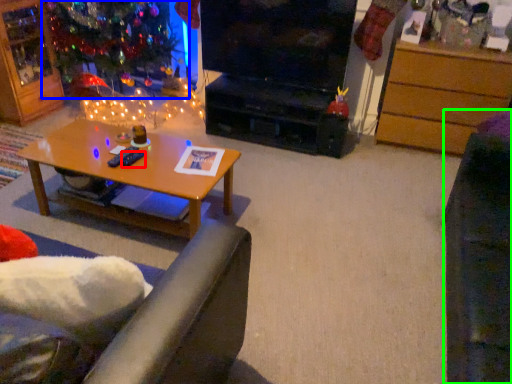
Question: Which is farther away from remote control (highlighted by a red box)? christmas tree (highlighted by a blue box) or swivel chair (highlighted by a green box)?

Choices:
 (A) christmas tree
 (B) swivel chair

Answer: (A)